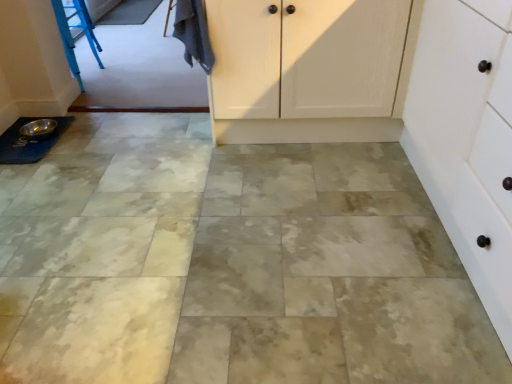
Question: From the image's perspective, would you say silver metallic bowl at lower left is positioned over white matte cabinet at right?

Choices:
 (A) yes
 (B) no

Answer: (A)

Question: Does silver metallic bowl at lower left have a greater height compared to white matte cabinet at right?

Choices:
 (A) no
 (B) yes

Answer: (A)

Question: Considering the relative positions of silver metallic bowl at lower left and white matte cabinet at right in the image provided, is silver metallic bowl at lower left to the right of white matte cabinet at right from the viewer's perspective?

Choices:
 (A) yes
 (B) no

Answer: (B)

Question: Can you confirm if silver metallic bowl at lower left is bigger than white matte cabinet at right?

Choices:
 (A) yes
 (B) no

Answer: (B)

Question: Is silver metallic bowl at lower left directly adjacent to white matte cabinet at right?

Choices:
 (A) yes
 (B) no

Answer: (B)

Question: Is white matte cabinet at right at the back of silver metallic bowl at lower left?

Choices:
 (A) yes
 (B) no

Answer: (B)

Question: Considering the relative sizes of dark gray fabric at upper left and white matte cabinet at right in the image provided, is dark gray fabric at upper left thinner than white matte cabinet at right?

Choices:
 (A) yes
 (B) no

Answer: (A)

Question: Is dark gray fabric at upper left not near white matte cabinet at right?

Choices:
 (A) no
 (B) yes

Answer: (B)

Question: Are dark gray fabric at upper left and white matte cabinet at right beside each other?

Choices:
 (A) yes
 (B) no

Answer: (B)

Question: Does dark gray fabric at upper left have a greater height compared to white matte cabinet at right?

Choices:
 (A) no
 (B) yes

Answer: (A)

Question: Considering the relative sizes of dark gray fabric at upper left and white matte cabinet at right in the image provided, is dark gray fabric at upper left bigger than white matte cabinet at right?

Choices:
 (A) yes
 (B) no

Answer: (B)

Question: Is dark gray fabric at upper left positioned behind white matte cabinet at right?

Choices:
 (A) no
 (B) yes

Answer: (B)

Question: Is the position of silver metallic bowl at lower left less distant than that of dark gray fabric at upper left?

Choices:
 (A) no
 (B) yes

Answer: (A)